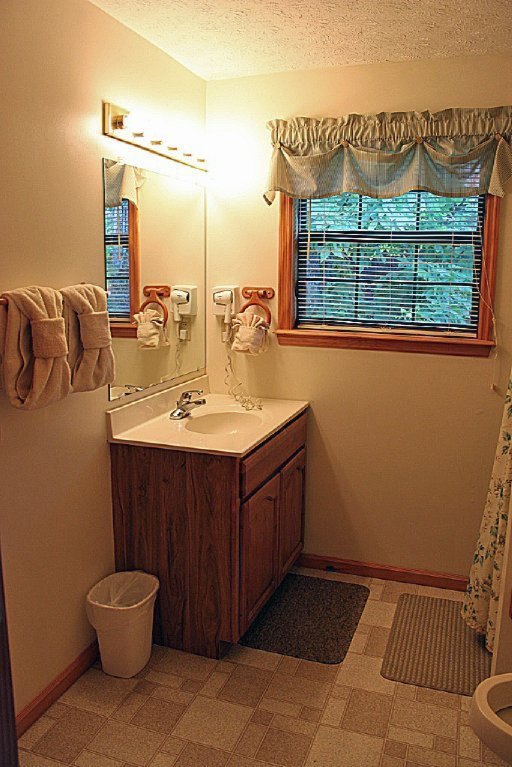
Image resolution: width=512 pixels, height=767 pixels. I want to click on handle, so click(187, 390).